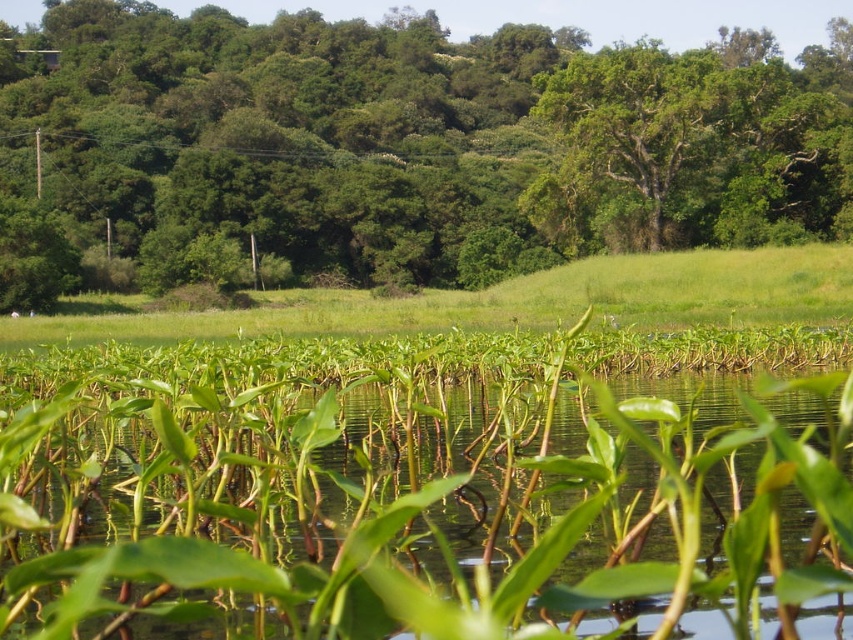
You are a gardener planning to plant flowers between the green leafy tree at center and the green grass at center. Which area has more space to accommodate the flowers?

The green leafy tree at center has a greater width than the green grass at center, so there is more space available around the green leafy tree at center to plant the flowers.

Based on the scene description, what object is located at the coordinates point (396, 148)?

The point (396, 148) indicates a green leafy tree at center.